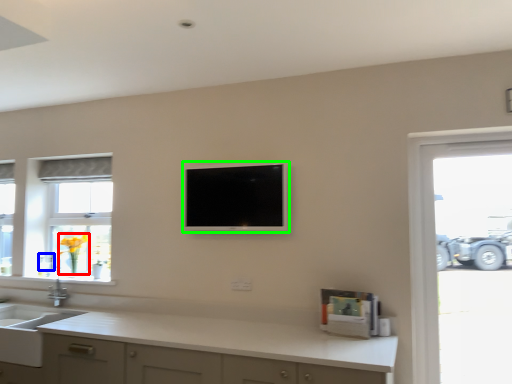
Question: Based on their relative distances, which object is farther from flower (highlighted by a red box)? Choose from faucet (highlighted by a blue box) and television (highlighted by a green box).

Choices:
 (A) faucet
 (B) television

Answer: (B)